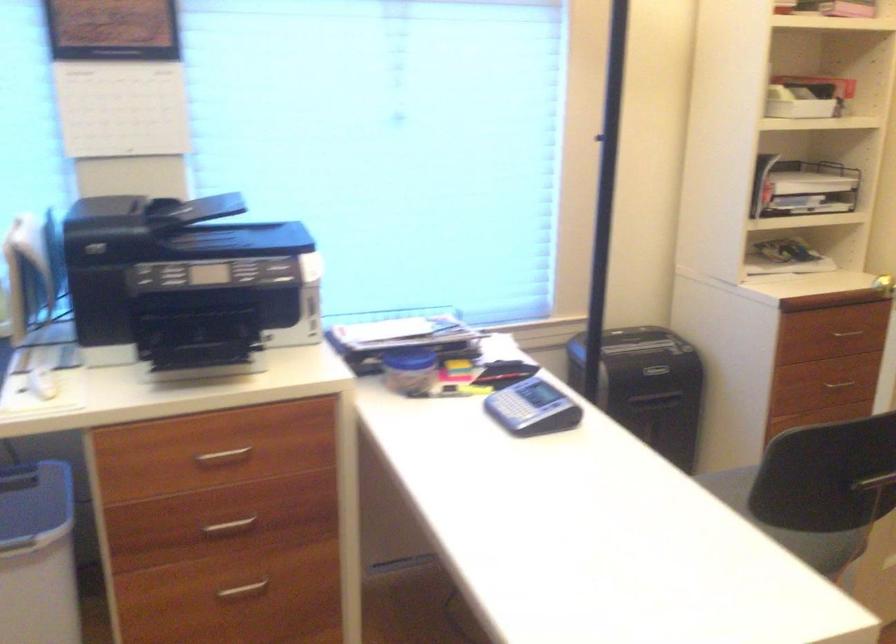
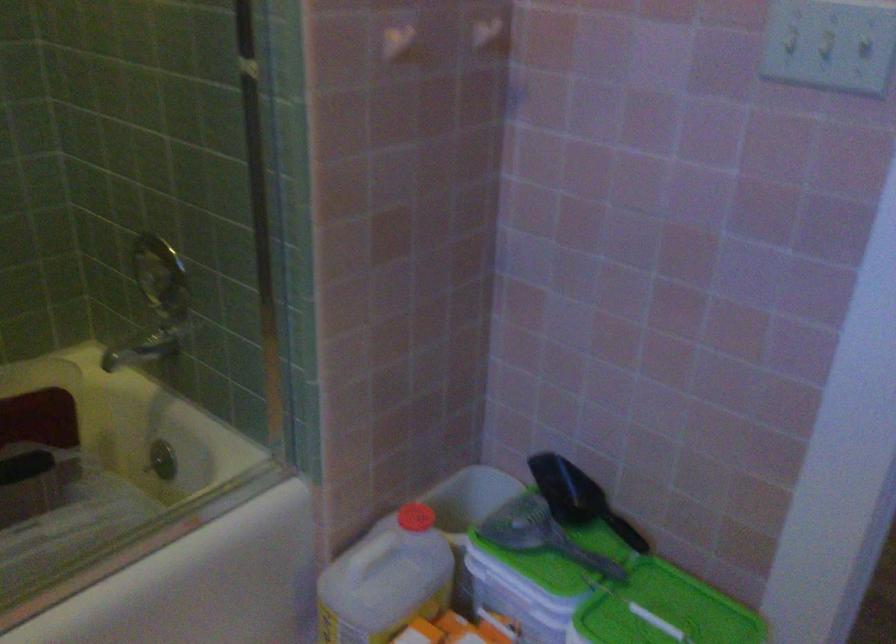
Question: I am providing you with two images of the same scene from different viewpoints. Which of the following objects are not visible in image2?

Choices:
 (A) blue rectangular case
 (B) light switch
 (C) red bottle cap
 (D) blue jar lid

Answer: (D)